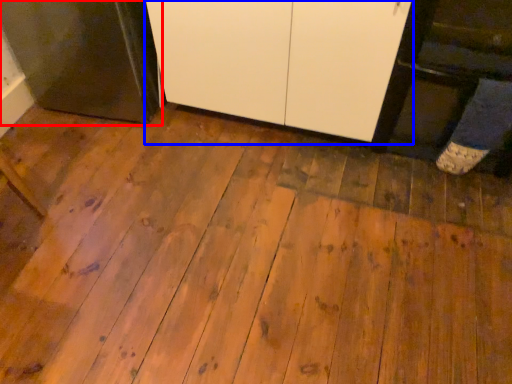
Question: Which point is further to the camera, appliance (highlighted by a red box) or cabinetry (highlighted by a blue box)?

Choices:
 (A) appliance
 (B) cabinetry

Answer: (A)